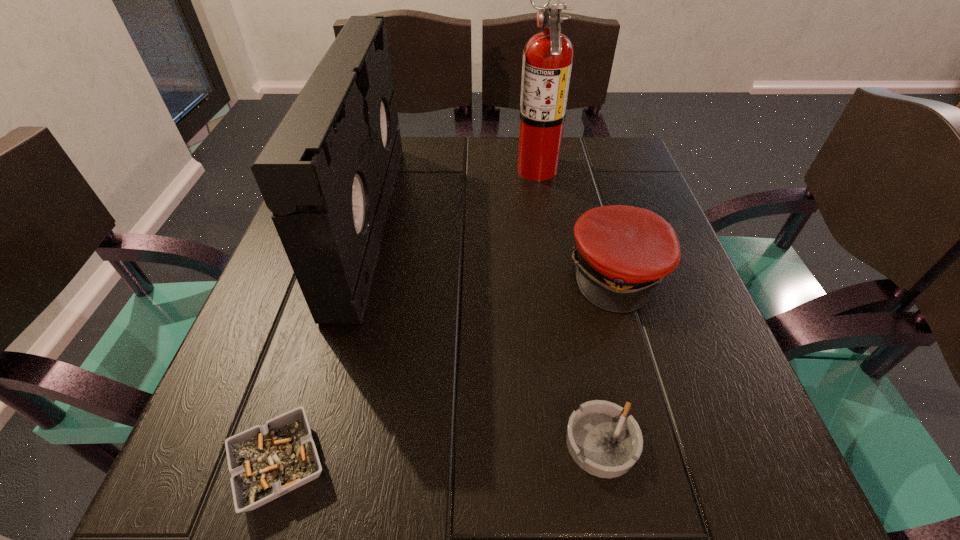
This screenshot has width=960, height=540. Find the location of `the tallest object`. the tallest object is located at coordinates (547, 62).

This screenshot has height=540, width=960. Find the location of `videotape`. videotape is located at coordinates (327, 173).

Find the location of a particular element. The width and height of the screenshot is (960, 540). cap is located at coordinates (622, 252).

Identify the location of the right ashtray. This screenshot has height=540, width=960. (605, 442).

I want to click on the left ashtray, so click(x=266, y=461).

Identify the location of free point located on the nozzle side of the tallest object. (402, 168).

The width and height of the screenshot is (960, 540). In order to click on vacant region located 0.340m on the nozzle side of the tallest object in this screenshot , I will do `click(372, 168)`.

The image size is (960, 540). I want to click on vacant space located on the nozzle side of the tallest object, so click(x=364, y=168).

At what (x,y) coordinates should I click in order to perform the action: click on vacant space located on the side of the second tallest object with visible spindles. Please return your answer as a coordinate pair (x, y). The width and height of the screenshot is (960, 540). Looking at the image, I should click on (502, 220).

Locate an element on the screen. Image resolution: width=960 pixels, height=540 pixels. blank space located 0.230m on the front of the cap with an emblem is located at coordinates (672, 449).